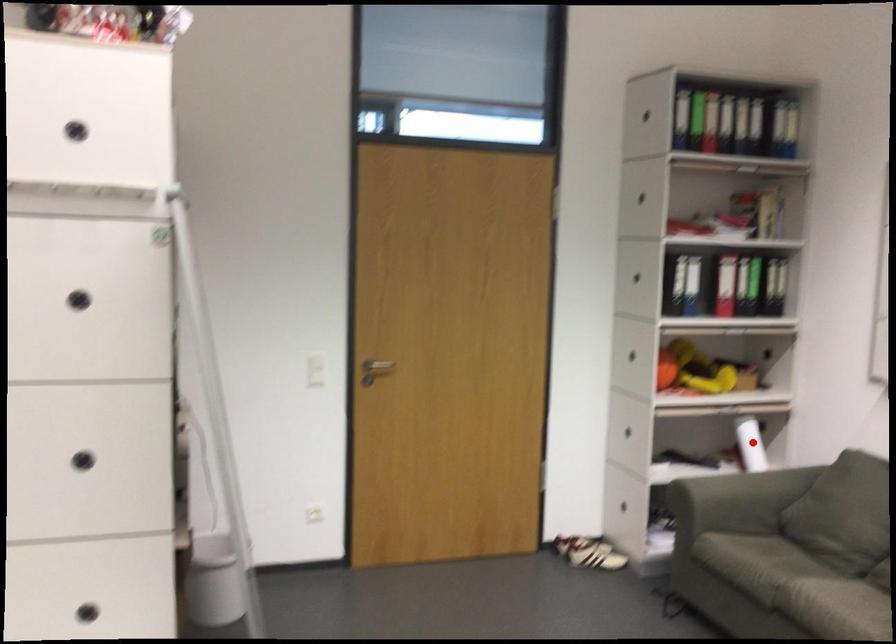
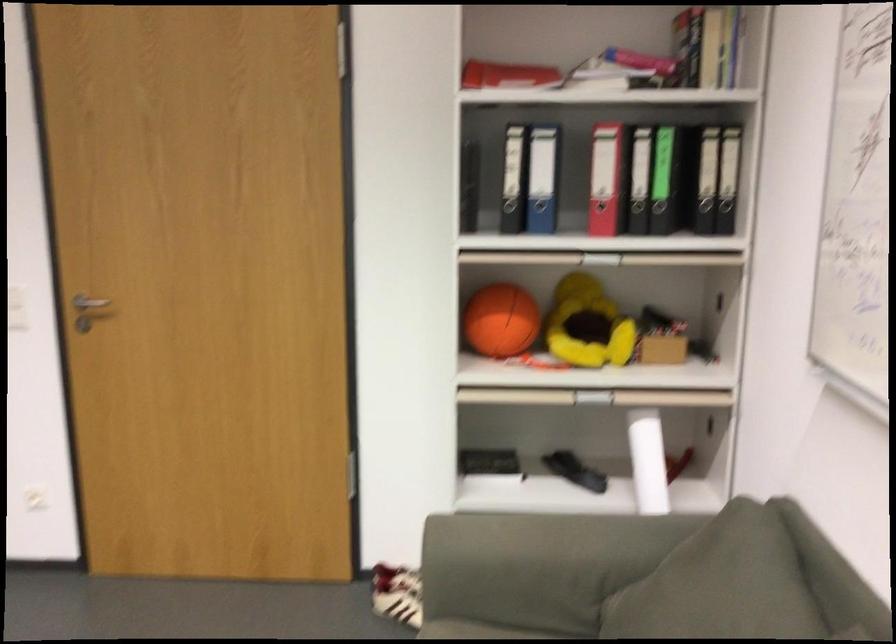
Question: I am providing you with two images of the same scene from different viewpoints. Given a red point in image1, look at the same physical point in image2. Is it:

Choices:
 (A) Closer to the viewpoint
 (B) Farther from the viewpoint

Answer: (A)